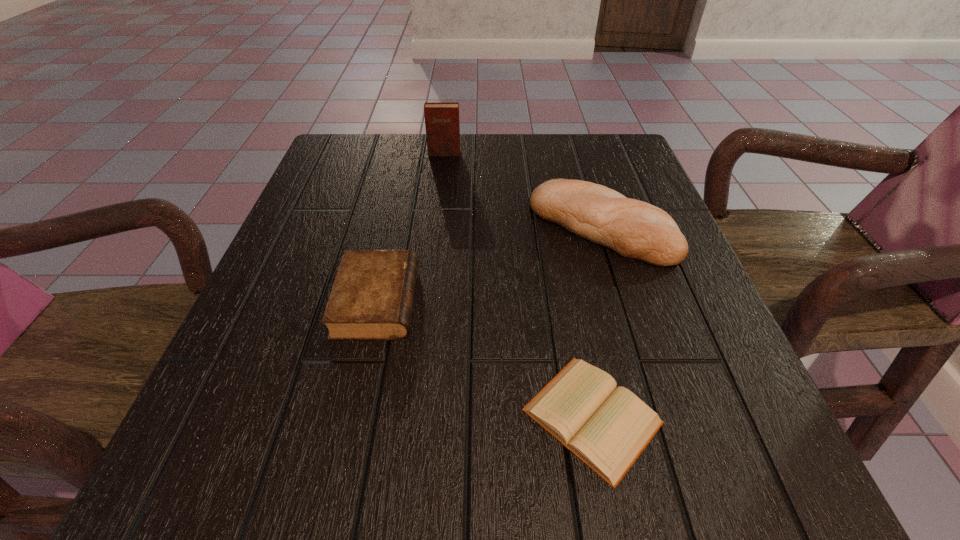
In the image, there is a desktop. Where is `vacant space at the far right corner`? Image resolution: width=960 pixels, height=540 pixels. vacant space at the far right corner is located at coordinates (576, 161).

Where is `free space at the near right corner`? Image resolution: width=960 pixels, height=540 pixels. free space at the near right corner is located at coordinates (679, 503).

The height and width of the screenshot is (540, 960). What are the coordinates of `vacant area that lies between the tallest object and the second shortest diary` in the screenshot? It's located at (411, 227).

Find the location of `vacant area that lies between the nearest object and the farthest diary`. vacant area that lies between the nearest object and the farthest diary is located at coordinates (518, 285).

I want to click on vacant area that lies between the second tallest object and the shortest diary, so click(597, 321).

Where is `free space between the farthest diary and the nearest object`? free space between the farthest diary and the nearest object is located at coordinates (518, 285).

At what (x,y) coordinates should I click in order to perform the action: click on free spot between the nearest diary and the bread. Please return your answer as a coordinate pair (x, y). This screenshot has width=960, height=540. Looking at the image, I should click on (597, 321).

Where is `vacant area between the tallest diary and the second nearest diary`? vacant area between the tallest diary and the second nearest diary is located at coordinates (411, 227).

Find the location of a particular element. Image resolution: width=960 pixels, height=540 pixels. free spot between the farthest object and the shortest object is located at coordinates click(x=518, y=285).

This screenshot has height=540, width=960. I want to click on free area in between the second farthest diary and the bread, so click(x=490, y=264).